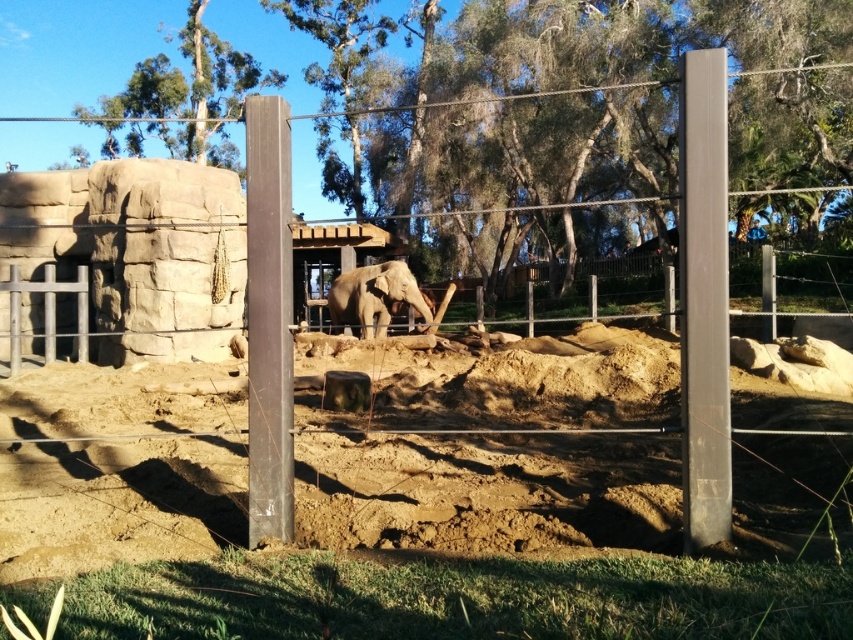
Question: Estimate the real-world distances between objects in this image. Which object is farther from the green leafy tree at upper left?

Choices:
 (A) smooth gray pole at right
 (B) green leafy tree at center
 (C) smooth brown pole at center
 (D) brown wooden fence at center

Answer: (A)

Question: Can you confirm if green leafy tree at upper left is positioned to the left of grayish-brown textured elephant at center?

Choices:
 (A) yes
 (B) no

Answer: (A)

Question: Which point appears closest to the camera in this image?

Choices:
 (A) (254, 220)
 (B) (839, 292)
 (C) (683, 49)
 (D) (717, 353)

Answer: (D)

Question: Does smooth gray pole at right have a greater width compared to smooth brown pole at center?

Choices:
 (A) yes
 (B) no

Answer: (B)

Question: Considering the real-world distances, which object is closest to the brown wooden fence at center?

Choices:
 (A) smooth gray pole at right
 (B) grayish-brown textured elephant at center
 (C) smooth brown pole at center

Answer: (B)

Question: Does green leafy tree at center appear over smooth gray pole at right?

Choices:
 (A) no
 (B) yes

Answer: (B)